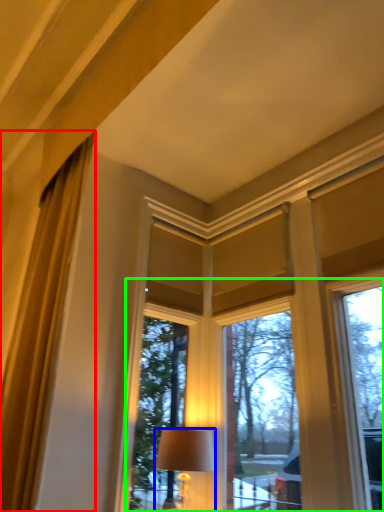
Question: Which object is positioned closest to curtain (highlighted by a red box)? Select from lamp (highlighted by a blue box) and bay window (highlighted by a green box).

Choices:
 (A) lamp
 (B) bay window

Answer: (A)